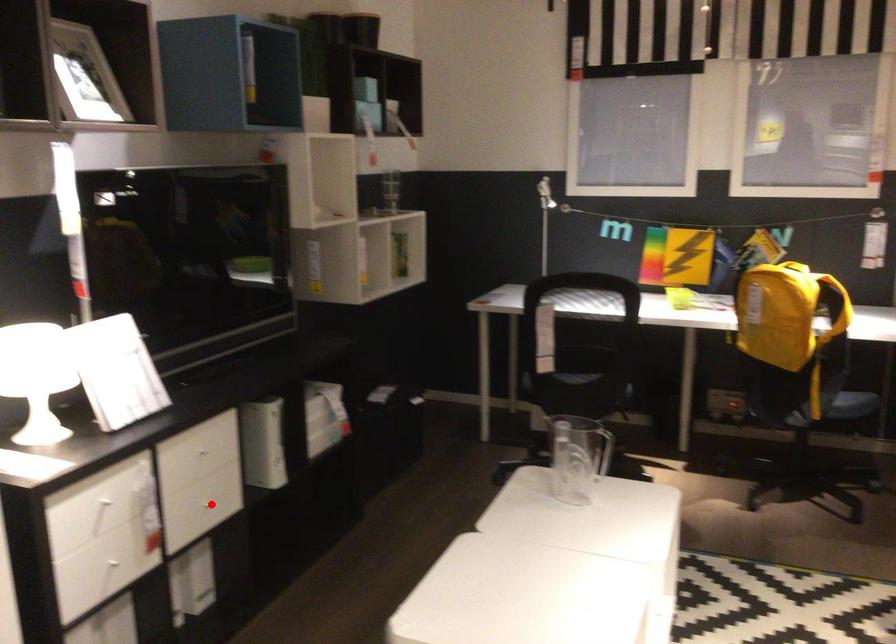
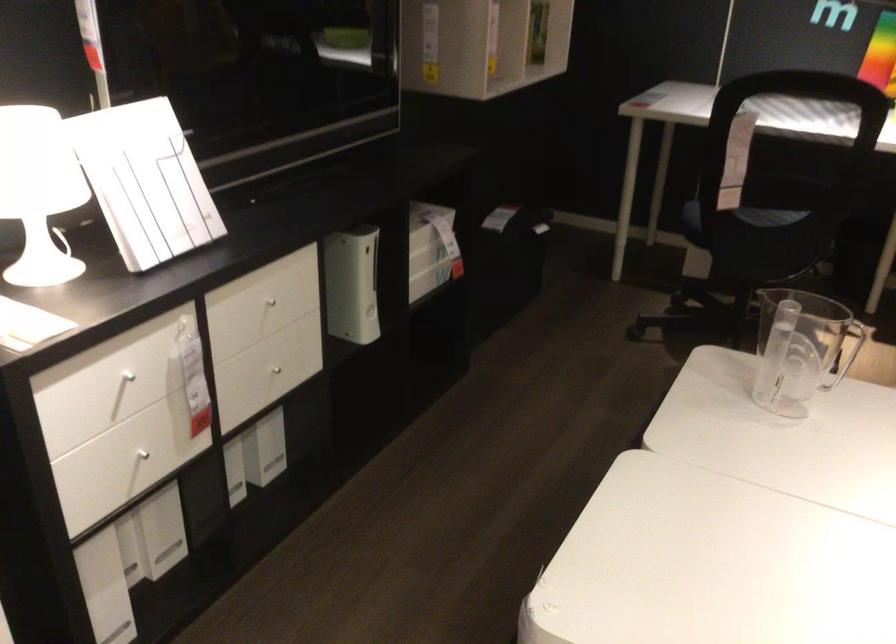
Question: I am providing you with two images of the same scene from different viewpoints. Given a red point in image1, look at the same physical point in image2. Is it:

Choices:
 (A) Closer to the viewpoint
 (B) Farther from the viewpoint

Answer: (A)